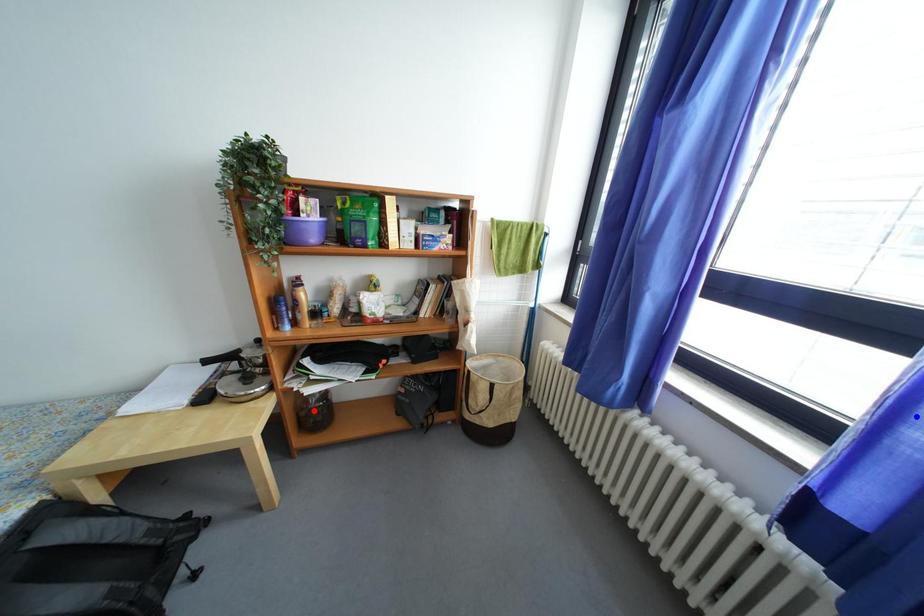
Question: In the image, two points are highlighted. Which point is nearer to the camera? Reply with the corresponding letter.

Choices:
 (A) blue point
 (B) red point

Answer: (A)